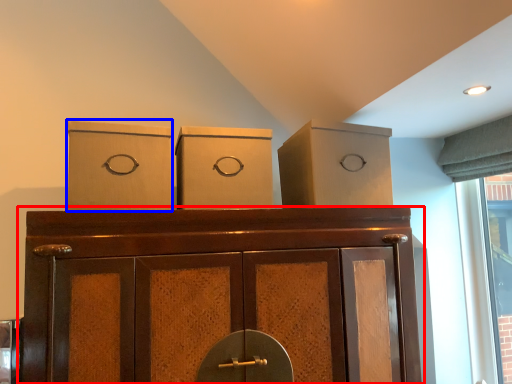
Question: Which object appears farthest to the camera in this image, cupboard (highlighted by a red box) or cardboard box (highlighted by a blue box)?

Choices:
 (A) cupboard
 (B) cardboard box

Answer: (B)